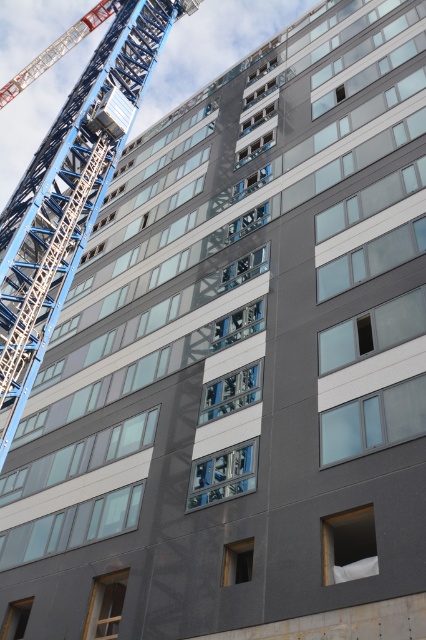
Is blue metallic crane at upper left positioned at the back of matte black lift at upper left?

No.

Is point (26, 365) farther from camera compared to point (106, 92)?

That is False.

Is point (25, 358) farther from viewer compared to point (101, 122)?

No.

Where is `blue metallic crane at upper left`? This screenshot has height=640, width=426. blue metallic crane at upper left is located at coordinates (66, 196).

Can you confirm if red painted metal crane arm at upper left is wider than matte black lift at upper left?

Correct, the width of red painted metal crane arm at upper left exceeds that of matte black lift at upper left.

Is point (5, 100) less distant than point (131, 118)?

No, (5, 100) is behind (131, 118).

Is point (8, 100) in front of point (131, 109)?

No.

What are the coordinates of `red painted metal crane arm at upper left` in the screenshot? It's located at (57, 49).

Is blue metallic crane at upper left to the right of red painted metal crane arm at upper left from the viewer's perspective?

Correct, you'll find blue metallic crane at upper left to the right of red painted metal crane arm at upper left.

Consider the image. Is blue metallic crane at upper left in front of red painted metal crane arm at upper left?

Yes, it is.

Is point (83, 81) positioned in front of point (74, 40)?

Yes, point (83, 81) is in front of point (74, 40).

Locate an element on the screen. This screenshot has height=640, width=426. blue metallic crane at upper left is located at coordinates (66, 196).